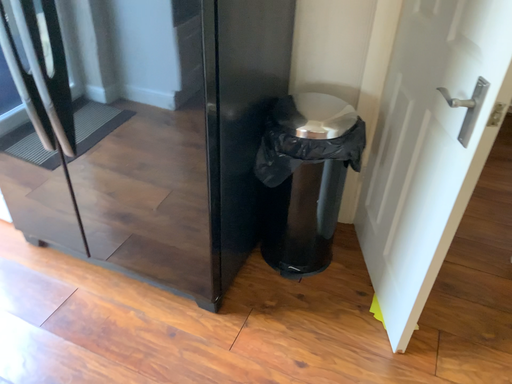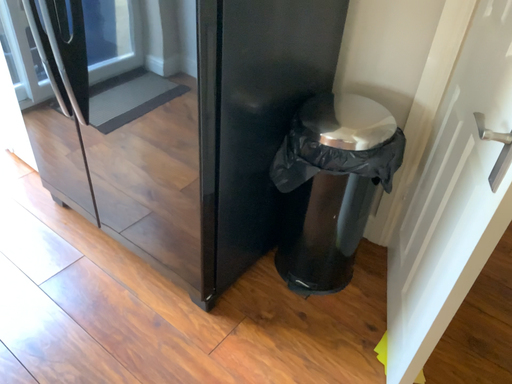
Question: How did the camera likely rotate when shooting the video?

Choices:
 (A) rotated right
 (B) rotated left

Answer: (B)